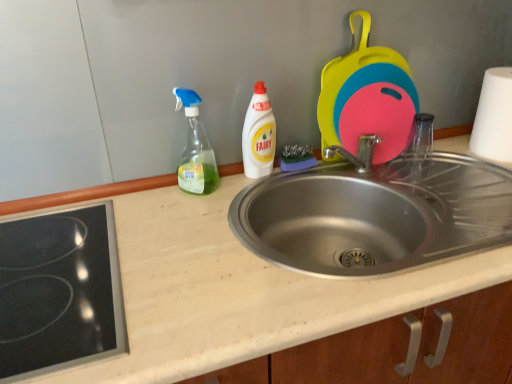
The image size is (512, 384). I want to click on free location in front of transparent plastic spray bottle at center, the 1th bottle in the left-to-right sequence, so click(189, 220).